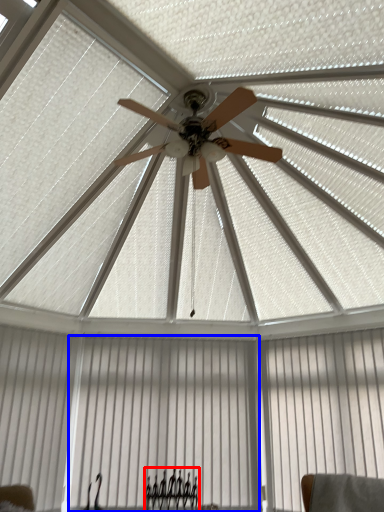
Question: Among these objects, which one is nearest to the camera, furniture (highlighted by a red box) or curtain (highlighted by a blue box)?

Choices:
 (A) furniture
 (B) curtain

Answer: (A)